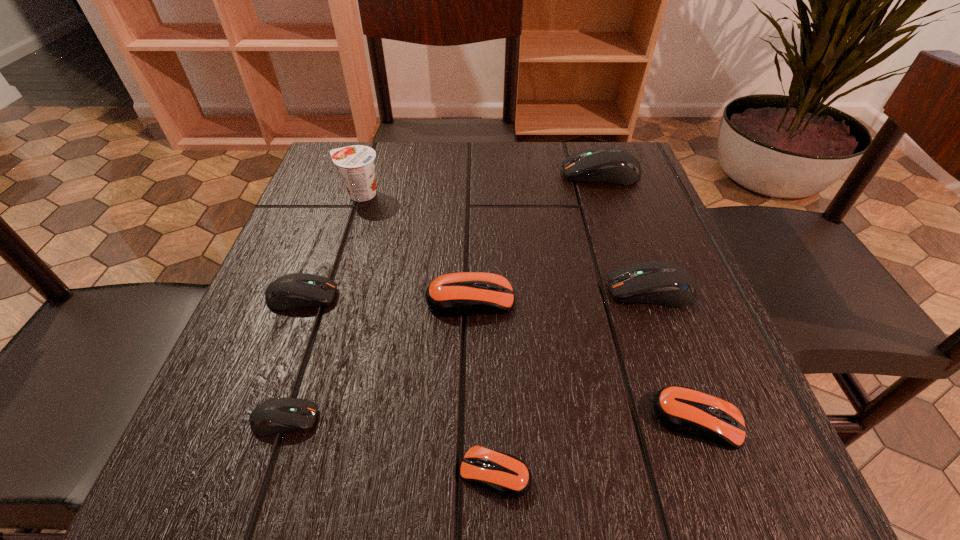
Where is `the shortest computer mouse`? Image resolution: width=960 pixels, height=540 pixels. the shortest computer mouse is located at coordinates (506, 475).

Find the location of a particular element. The image size is (960, 540). free region located on the back of the tallest object is located at coordinates coord(370,166).

You are a GUI agent. You are given a task and a screenshot of the screen. Output one action in this format:
    pyautogui.click(x=<x>, y=<y>)
    Task: Click on the free space located 0.110m on the button of the farthest computer mouse
    The image size is (960, 540).
    Given the screenshot: What is the action you would take?
    pyautogui.click(x=515, y=174)

I want to click on vacant space located on the button of the farthest computer mouse, so click(x=496, y=174).

You are a GUI agent. You are given a task and a screenshot of the screen. Output one action in this format:
    pyautogui.click(x=<x>, y=<y>)
    Task: Click on the vacant space located on the button of the farthest computer mouse
    The width and height of the screenshot is (960, 540).
    Given the screenshot: What is the action you would take?
    pyautogui.click(x=527, y=174)

Find the location of a particular element. This screenshot has height=540, width=960. free point located on the button of the third tallest object is located at coordinates (400, 290).

Where is `vacant space located on the button of the third tallest object`? vacant space located on the button of the third tallest object is located at coordinates (544, 290).

Where is `vacant space located 0.120m on the button of the third tallest object`? This screenshot has height=540, width=960. vacant space located 0.120m on the button of the third tallest object is located at coordinates (539, 290).

You are a GUI agent. You are given a task and a screenshot of the screen. Output one action in this format:
    pyautogui.click(x=<x>, y=<y>)
    Task: Click on the free point located on the left of the biggest orange computer mouse
    This screenshot has width=960, height=540.
    Given the screenshot: What is the action you would take?
    tap(338, 299)

I want to click on vacant space located 0.280m on the button of the second smallest dark computer equipment, so click(x=501, y=296).